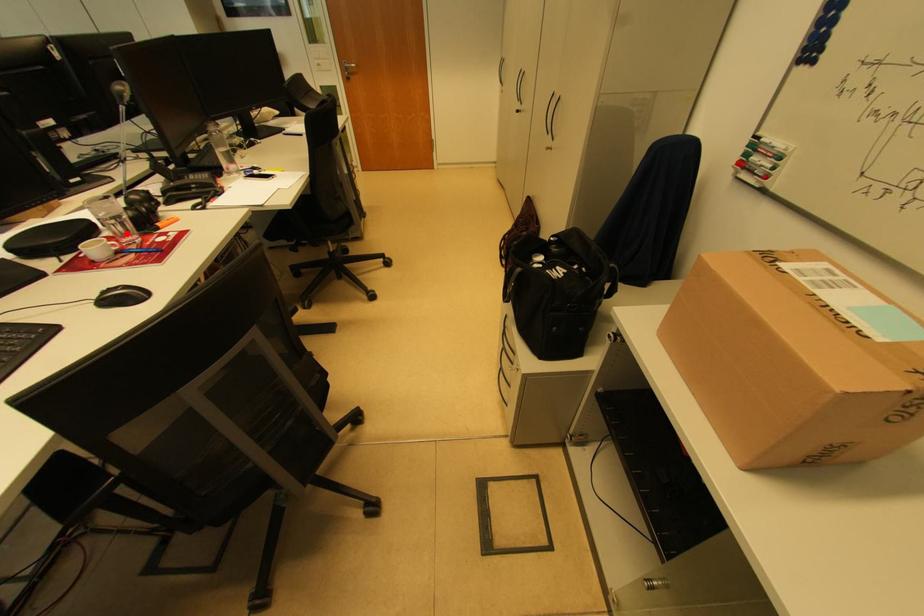
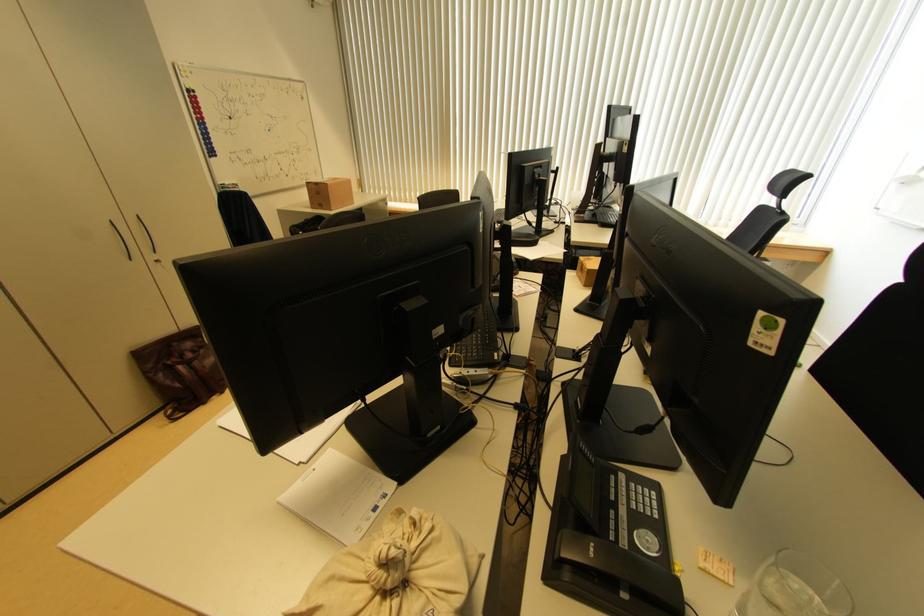
Question: I am providing you with two images of the same scene from different viewpoints. A red point is marked on the first image. Can you still see the location of the red point in image 2?

Choices:
 (A) Yes
 (B) No

Answer: (B)